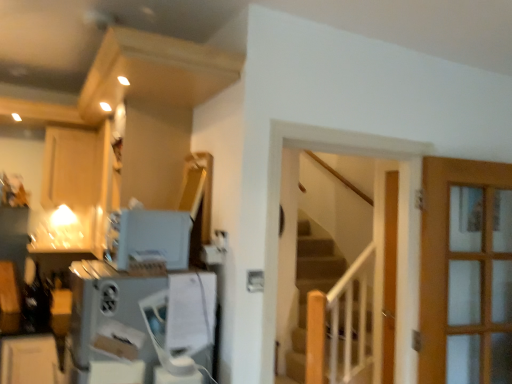
Question: From a real-world perspective, is matte wood cabinet at upper left positioned under wooden stairs at center based on gravity?

Choices:
 (A) no
 (B) yes

Answer: (A)

Question: Considering the relative sizes of matte wood cabinet at upper left and wooden stairs at center in the image provided, is matte wood cabinet at upper left shorter than wooden stairs at center?

Choices:
 (A) no
 (B) yes

Answer: (B)

Question: Considering the relative sizes of matte wood cabinet at upper left and wooden stairs at center in the image provided, is matte wood cabinet at upper left wider than wooden stairs at center?

Choices:
 (A) yes
 (B) no

Answer: (A)

Question: Considering the relative sizes of matte wood cabinet at upper left and wooden stairs at center in the image provided, is matte wood cabinet at upper left taller than wooden stairs at center?

Choices:
 (A) yes
 (B) no

Answer: (B)

Question: Could you tell me if matte wood cabinet at upper left is turned towards wooden stairs at center?

Choices:
 (A) no
 (B) yes

Answer: (A)

Question: From the image's perspective, is matte wood cabinet at upper left located above or below satin white toaster at upper center, which ranks as the second appliance in bottom-to-top order?

Choices:
 (A) below
 (B) above

Answer: (B)

Question: From a real-world perspective, is matte wood cabinet at upper left above or below satin white toaster at upper center, which ranks as the second appliance in bottom-to-top order?

Choices:
 (A) below
 (B) above

Answer: (B)

Question: Is matte wood cabinet at upper left in front of or behind satin white toaster at upper center, arranged as the 1th appliance when viewed from the top, in the image?

Choices:
 (A) behind
 (B) front

Answer: (A)

Question: Is point (88, 185) positioned closer to the camera than point (137, 228)?

Choices:
 (A) closer
 (B) farther

Answer: (B)

Question: From the image's perspective, relative to satin white toaster at upper center, arranged as the 1th appliance when viewed from the top, is satin silver appliance at lower left, which appears as the second appliance when viewed from the top, above or below?

Choices:
 (A) above
 (B) below

Answer: (B)

Question: From a real-world perspective, is satin silver appliance at lower left, which appears as the second appliance when viewed from the top, physically located above or below satin white toaster at upper center, which ranks as the second appliance in bottom-to-top order?

Choices:
 (A) above
 (B) below

Answer: (B)

Question: In the image, is satin silver appliance at lower left, which appears as the second appliance when viewed from the top, positioned in front of or behind satin white toaster at upper center, which ranks as the second appliance in bottom-to-top order?

Choices:
 (A) behind
 (B) front

Answer: (B)

Question: From their relative heights in the image, would you say satin silver appliance at lower left, the 1th appliance from the bottom, is taller or shorter than satin white toaster at upper center, which ranks as the second appliance in bottom-to-top order?

Choices:
 (A) short
 (B) tall

Answer: (B)

Question: In terms of width, does satin white toaster at upper center, which ranks as the second appliance in bottom-to-top order, look wider or thinner when compared to satin silver appliance at lower left, the 1th appliance from the bottom?

Choices:
 (A) thin
 (B) wide

Answer: (A)

Question: Is point (187, 218) closer or farther from the camera than point (159, 307)?

Choices:
 (A) farther
 (B) closer

Answer: (A)